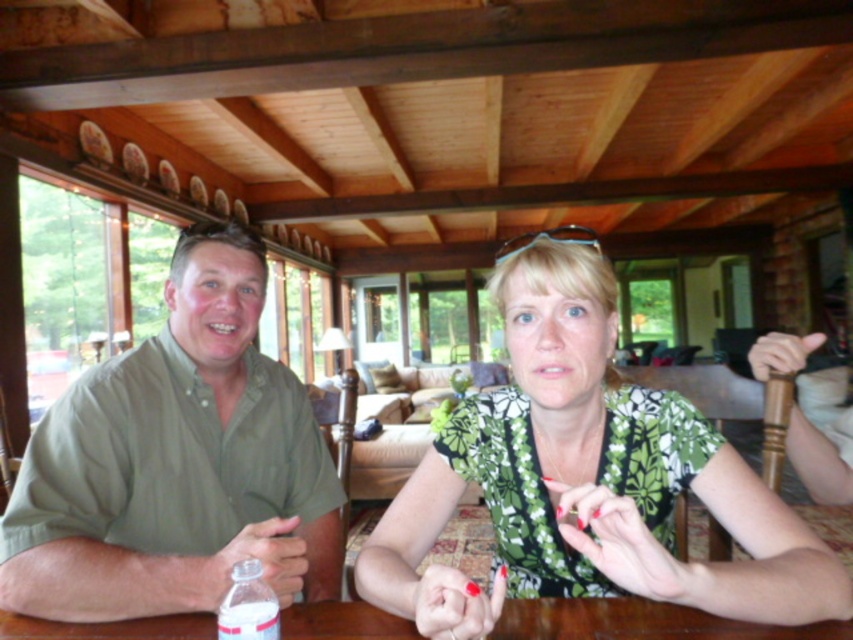
You are a photographer setting up a shoot in this rustic room. You want to ensure the green floral blouse at center and the brown wooden table at center are both visible in the frame. Based on their positions, which object is closer to the camera?

The green floral blouse at center is in front of the brown wooden table at center, so it is closer to the camera.

In the scene shown: You are a guest in this rustic room and want to place a small decorative item on the brown wooden table at center. Considering the size of the white plastic bottle at lower left, can you estimate if there is enough space on the table?

The brown wooden table at center is wider than the white plastic bottle at lower left, so there should be sufficient space to place a small decorative item alongside the white plastic bottle at lower left.

You are standing 1.2 meters away from the camera. Can you reach the point at coordinates point (165,419) without moving your position?

The distance of point (165,419) from the camera is 1.13 meters. Since you are standing 1.2 meters away from the camera, you can reach the point at coordinates point (165,419) without moving your position because your distance is slightly farther than the point.